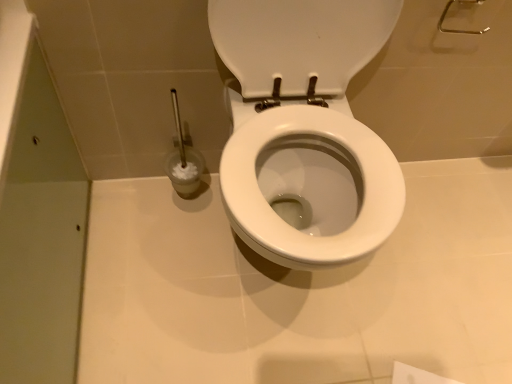
Question: Should I look upward or downward to see clear plastic brush at left?

Choices:
 (A) down
 (B) up

Answer: (B)